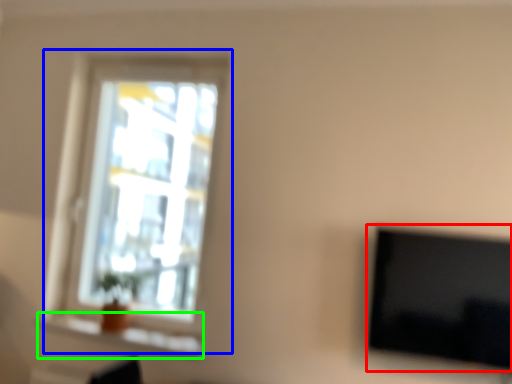
Question: Estimate the real-world distances between objects in this image. Which object is closer to television (highlighted by a red box), window (highlighted by a blue box) or window sill (highlighted by a green box)?

Choices:
 (A) window
 (B) window sill

Answer: (B)